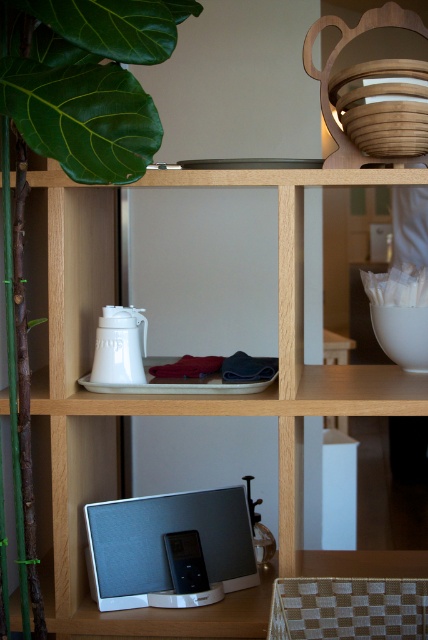
Where is `green leafy plant at upper left`? green leafy plant at upper left is located at coordinates (76, 132).

Between green leafy plant at upper left and silver fabric speaker at lower center, which one has more height?

green leafy plant at upper left

This screenshot has height=640, width=428. Identify the location of green leafy plant at upper left. (76, 132).

The image size is (428, 640). Find the location of `green leafy plant at upper left`. green leafy plant at upper left is located at coordinates (76, 132).